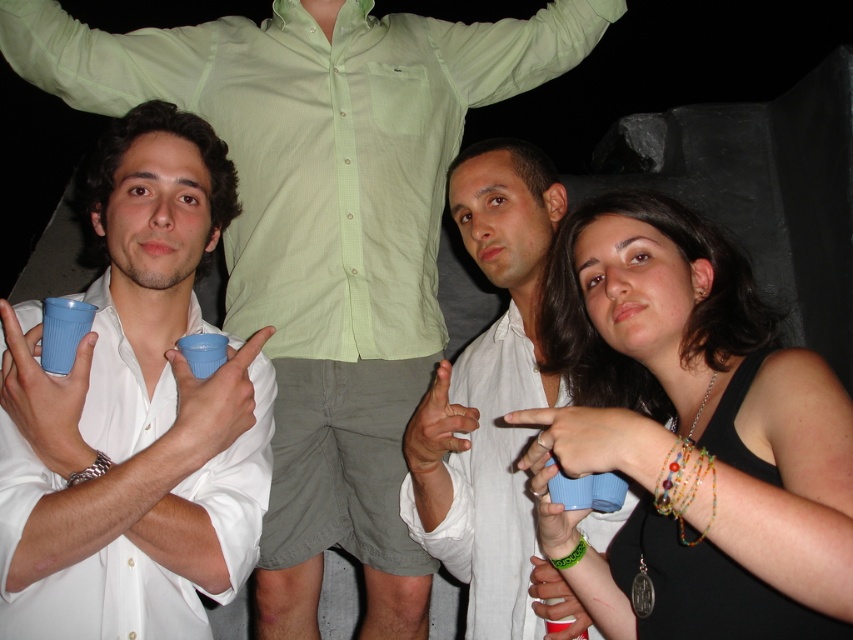
You are at a party and notice two items in the scene described. The matte plastic cup at left and the white matte shirt at center. Which object is located higher in the image?

The matte plastic cup at left is positioned over the white matte shirt at center, meaning it is higher up in the image.

You are a photographer adjusting your camera settings to focus on the matte plastic cup at left and the white matte shirt at center. Which object should you focus on first to ensure it appears sharp in the photo?

The matte plastic cup at left should be focused on first because it is closer to the viewer than the white matte shirt at center.

You are at a party and need to grab a drink. You are standing between the matte plastic cup at left and the white matte shirt at center. Can you reach both items without moving your feet?

The matte plastic cup at left and white matte shirt at center are 25.75 inches apart. Since the distance between them is greater than typical human arm span for simultaneous reaching, you cannot reach both items without moving your feet.